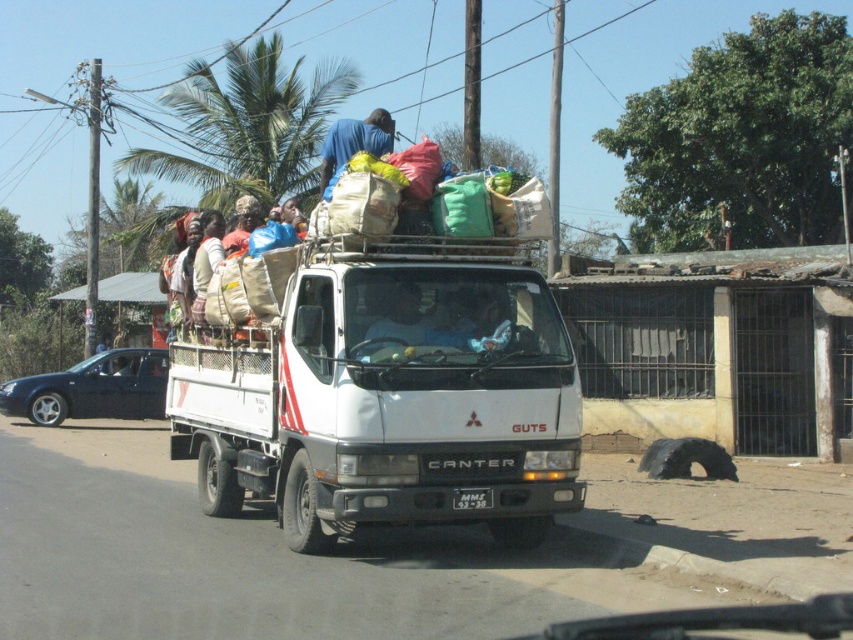
You are a delivery person who needs to unload the sacks from the white Mitsubishi Canter truck. You notice the green leafy palm tree at upper center and the blue fabric shirt at center. Which object is taller?

The green leafy palm tree at upper center is much taller than the blue fabric shirt at center.

You are a delivery person standing in the street scene. You notice both the blue fabric shirt at center and the brown woven basket at upper center. Which object is closer to you?

The blue fabric shirt at center is closer to you because it is in front of the brown woven basket at upper center.